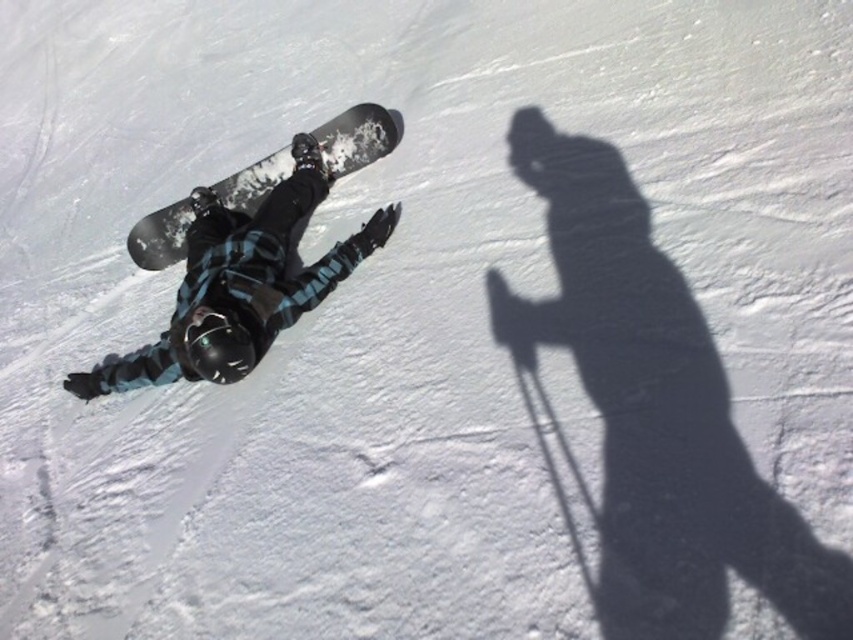
Wait, the objects list has two entries that are almost identical except for spacing. Is this a typo? The first is matte black snowboard at center and the second is black matte snowboard at center. The difference is the order of adjectives and a space. Should I treat them as separate objects or consider it a duplication? Also, the scene mentions a snowboard positioned diagonally across the frame. The objects description says the first might be wider than the second. But if they are the same object, this is a

The two entries in the Objects list are duplicates with a minor difference in adjective order and spacing. They refer to the same snowboard. The Objects Description likely contains an error since comparing the same object to itself doesn

You are a photographer trying to capture the snowboarder in the image. You notice two snowboards labeled as matte black snowboard at center and black matte snowboard at center. Which one is actually the snowboarder riding? Explain your reasoning based on their positions.

The snowboarder is riding the matte black snowboard at center because it is positioned on the left side of the black matte snowboard at center, and typically, the snowboarder would be on the board they are riding.